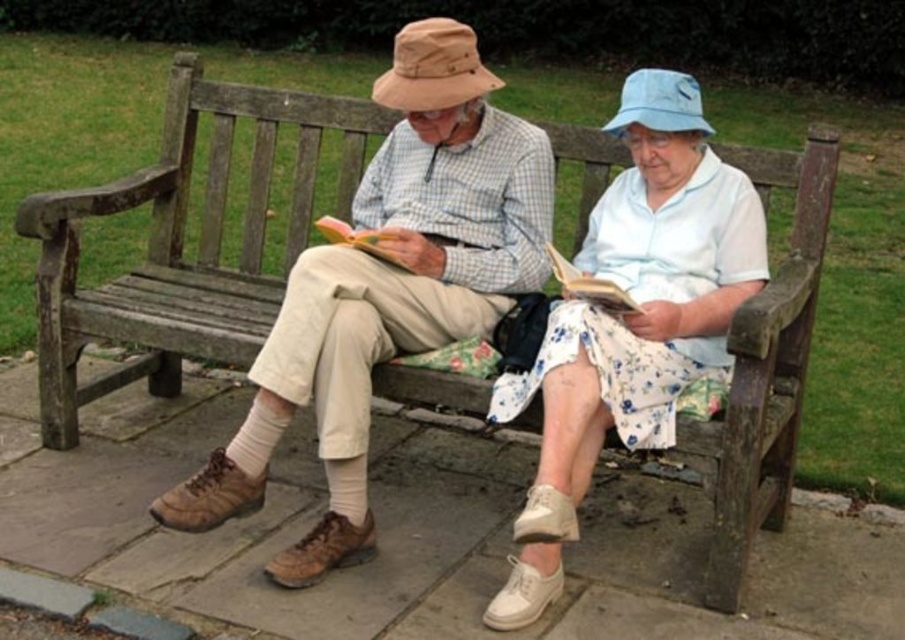
Describe the element at coordinates (631, 320) in the screenshot. I see `white floral skirt at center` at that location.

I want to click on white floral skirt at center, so click(631, 320).

The image size is (905, 640). Find the location of `white floral skirt at center`. white floral skirt at center is located at coordinates (631, 320).

Can you confirm if brown leather shoes at center is thinner than white floral skirt at center?

Incorrect, brown leather shoes at center's width is not less than white floral skirt at center's.

Looking at this image, who is higher up, brown leather shoes at center or white floral skirt at center?

brown leather shoes at center is above.

Does point (351, 534) come behind point (670, 124)?

Yes, it is behind point (670, 124).

At what (x,y) coordinates should I click in order to perform the action: click on brown leather shoes at center. Please return your answer as a coordinate pair (x, y). Looking at the image, I should click on (388, 289).

The image size is (905, 640). Find the location of `brown leather shoes at center`. brown leather shoes at center is located at coordinates (388, 289).

Between brown leather shoes at center and hardcover book at center, which one is positioned lower?

brown leather shoes at center is below.

The height and width of the screenshot is (640, 905). What do you see at coordinates (388, 289) in the screenshot?
I see `brown leather shoes at center` at bounding box center [388, 289].

At what (x,y) coordinates should I click in order to perform the action: click on brown leather shoes at center. Please return your answer as a coordinate pair (x, y). This screenshot has width=905, height=640. Looking at the image, I should click on (388, 289).